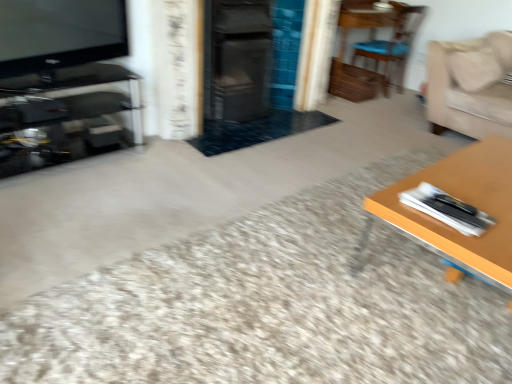
The image size is (512, 384). I want to click on free region under matte black tv at upper left (from a real-world perspective), so click(x=72, y=74).